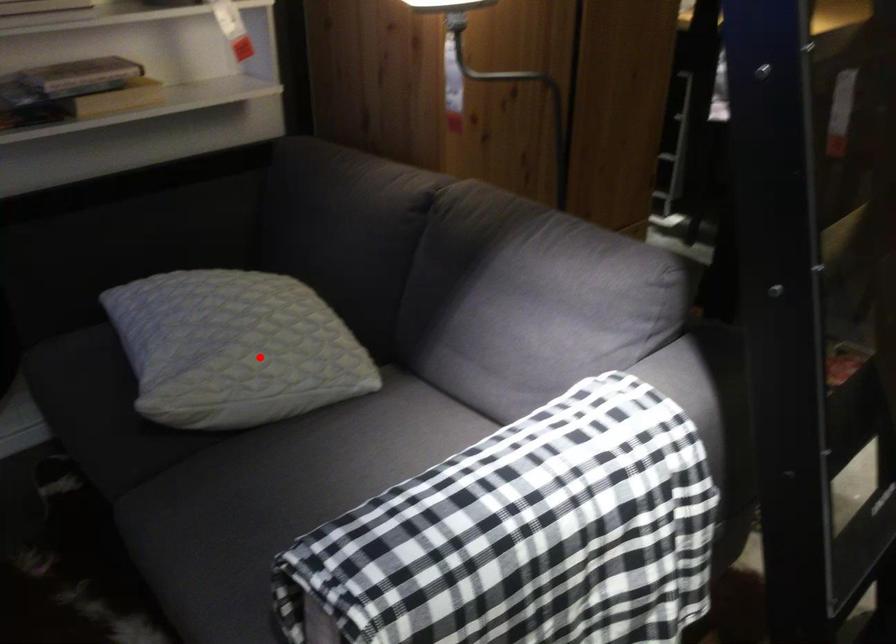
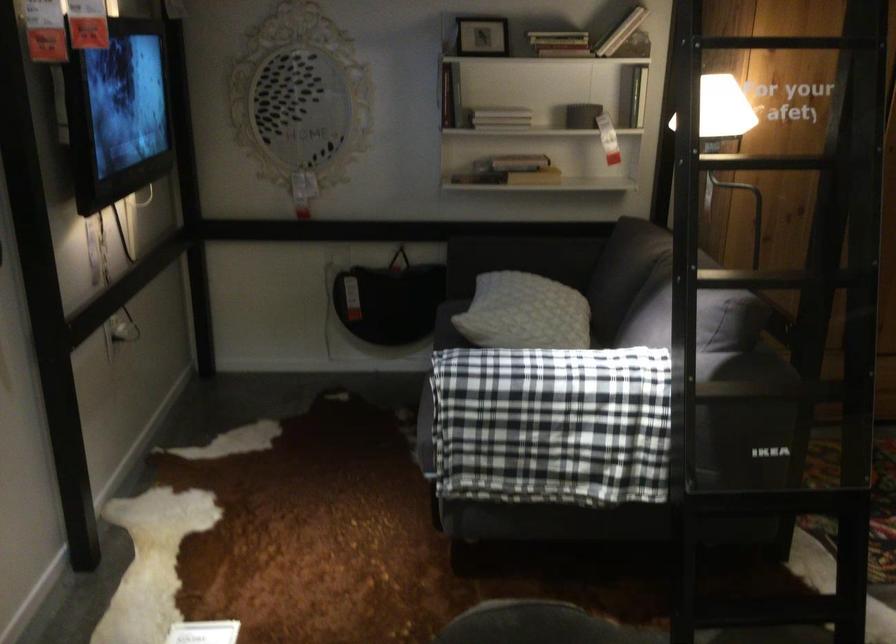
Locate, in the second image, the point that corresponds to the highlighted location in the first image.

(524, 313)